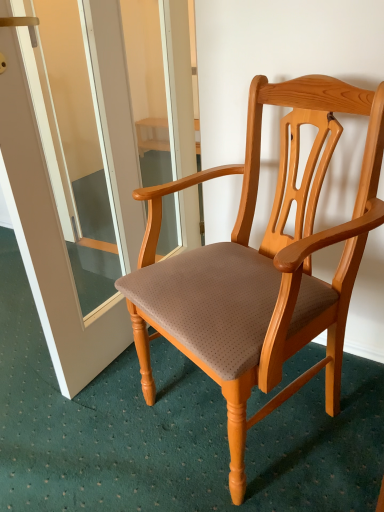
Question: From a real-world perspective, is transparent glass screen door at center on light brown wood chair at center?

Choices:
 (A) yes
 (B) no

Answer: (A)

Question: Is the depth of transparent glass screen door at center greater than that of light brown wood chair at center?

Choices:
 (A) yes
 (B) no

Answer: (A)

Question: Considering the relative sizes of transparent glass screen door at center and light brown wood chair at center in the image provided, is transparent glass screen door at center smaller than light brown wood chair at center?

Choices:
 (A) yes
 (B) no

Answer: (A)

Question: Is transparent glass screen door at center turned away from light brown wood chair at center?

Choices:
 (A) yes
 (B) no

Answer: (A)

Question: From a real-world perspective, is transparent glass screen door at center physically below light brown wood chair at center?

Choices:
 (A) no
 (B) yes

Answer: (A)

Question: Is transparent glass screen door at center completely or partially outside of light brown wood chair at center?

Choices:
 (A) yes
 (B) no

Answer: (A)

Question: Is light brown wood chair at center smaller than transparent glass screen door at center?

Choices:
 (A) no
 (B) yes

Answer: (A)

Question: Is light brown wood chair at center located outside transparent glass screen door at center?

Choices:
 (A) no
 (B) yes

Answer: (B)

Question: Does light brown wood chair at center contain transparent glass screen door at center?

Choices:
 (A) no
 (B) yes

Answer: (A)

Question: Considering the relative sizes of light brown wood chair at center and transparent glass screen door at center in the image provided, is light brown wood chair at center bigger than transparent glass screen door at center?

Choices:
 (A) no
 (B) yes

Answer: (B)

Question: Is light brown wood chair at center positioned with its back to transparent glass screen door at center?

Choices:
 (A) no
 (B) yes

Answer: (A)

Question: Is light brown wood chair at center at the left side of transparent glass screen door at center?

Choices:
 (A) yes
 (B) no

Answer: (B)

Question: In terms of height, does transparent glass screen door at center look taller or shorter compared to light brown wood chair at center?

Choices:
 (A) tall
 (B) short

Answer: (A)